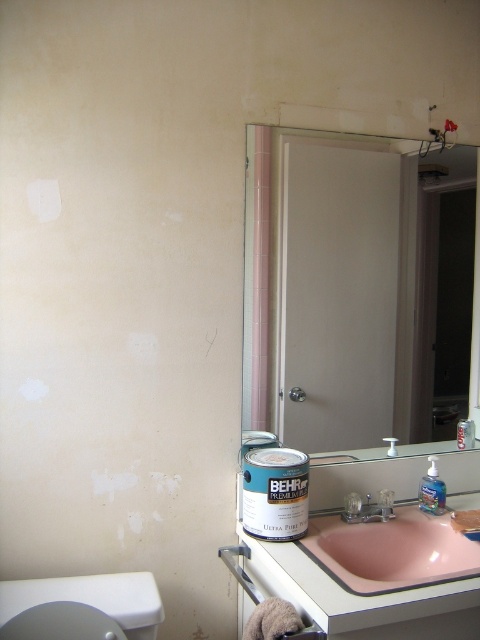
Does point (320, 180) lie in front of point (422, 577)?

No, it is behind (422, 577).

Which of these two, smooth white door at right or pink glossy sink at lower center, stands shorter?

Standing shorter between the two is pink glossy sink at lower center.

Does point (350, 312) lie in front of point (371, 595)?

No, (350, 312) is behind (371, 595).

Identify the location of smooth white door at right. Image resolution: width=480 pixels, height=640 pixels. (339, 284).

Who is higher up, pink glossy sink at lower center or white glossy toilet bowl at lower left?

Positioned higher is pink glossy sink at lower center.

Image resolution: width=480 pixels, height=640 pixels. Find the location of `pink glossy sink at lower center`. pink glossy sink at lower center is located at coordinates (389, 550).

Who is taller, smooth white door at right or white glossy toilet bowl at lower left?

Standing taller between the two is smooth white door at right.

Is smooth white door at right smaller than white glossy toilet bowl at lower left?

No, smooth white door at right is not smaller than white glossy toilet bowl at lower left.

At what (x,y) coordinates should I click in order to perform the action: click on smooth white door at right. Please return your answer as a coordinate pair (x, y). This screenshot has width=480, height=640. Looking at the image, I should click on (339, 284).

I want to click on smooth white door at right, so click(x=339, y=284).